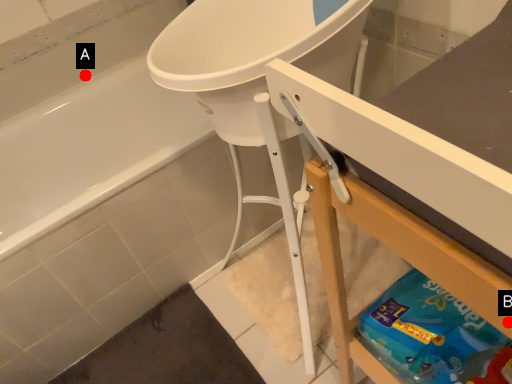
Question: Two points are circled on the image, labeled by A and B beside each circle. Which point is farther to the camera?

Choices:
 (A) A is further
 (B) B is further

Answer: (A)